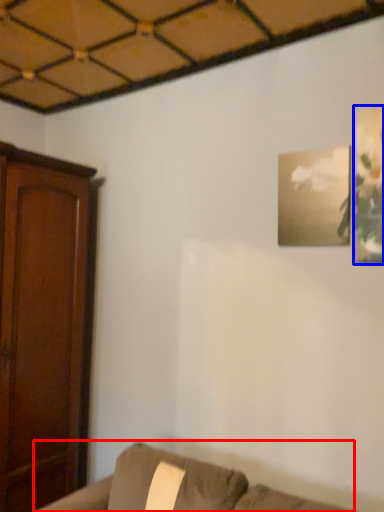
Question: Which of the following is the farthest to the observer, furniture (highlighted by a red box) or picture frame (highlighted by a blue box)?

Choices:
 (A) furniture
 (B) picture frame

Answer: (B)